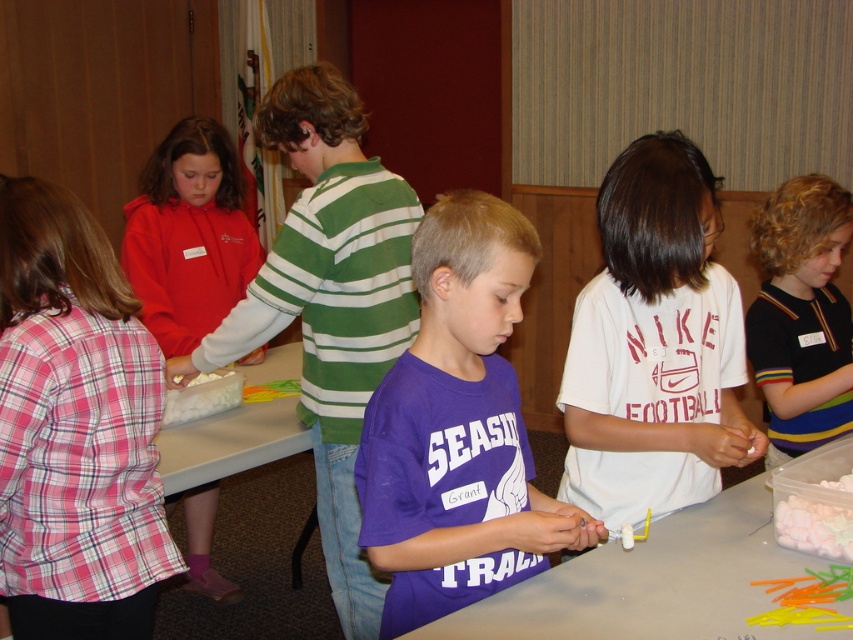
Question: Does purple matte shirt at center come behind white matte shirt at center?

Choices:
 (A) yes
 (B) no

Answer: (B)

Question: Is purple matte shirt at center positioned before matte red hoodie at left?

Choices:
 (A) no
 (B) yes

Answer: (B)

Question: Which object is positioned farthest from the matte red hoodie at left?

Choices:
 (A) white matte shirt at center
 (B) white marshmallow at lower center
 (C) green striped shirt at upper center

Answer: (A)

Question: Which object is farther from the camera taking this photo?

Choices:
 (A) white plastic table at center
 (B) white matte shirt at center
 (C) matte red hoodie at left
 (D) white marshmallow at lower center

Answer: (C)

Question: Can you confirm if purple matte shirt at center is positioned below white marshmallow at lower center?

Choices:
 (A) yes
 (B) no

Answer: (B)

Question: Which point is closer to the camera?

Choices:
 (A) (370, 244)
 (B) (219, 396)

Answer: (A)